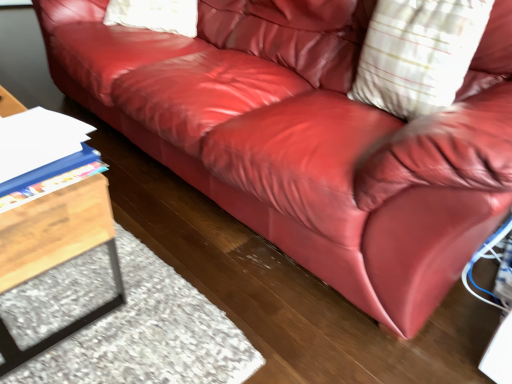
This screenshot has height=384, width=512. I want to click on empty space that is ontop of blue plastic folder at lower left, so click(34, 132).